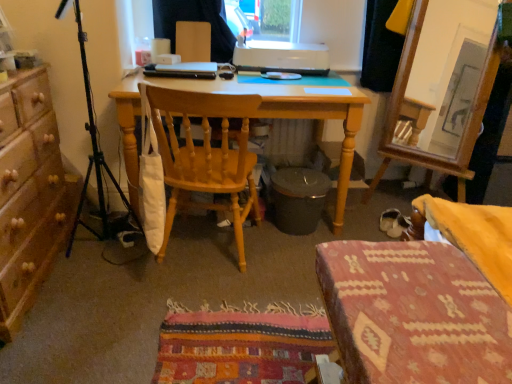
Locate an element on the screen. This screenshot has width=512, height=384. vacant area that is in front of dark gray plastic trash bin/can at center is located at coordinates (287, 251).